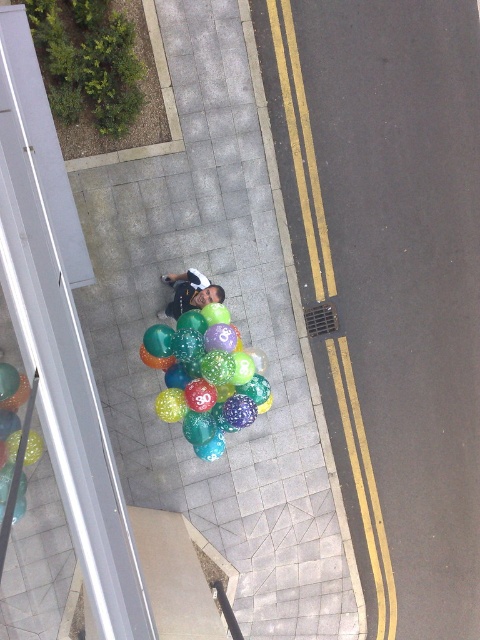
You are a delivery drone flying overhead and need to land on the smooth concrete sidewalk at center. However, there are translucent glossy balloons at center in the way. Based on their positions, can you land safely on the sidewalk?

The smooth concrete sidewalk at center is to the right of the translucent glossy balloons at center, so you can land safely on the sidewalk by moving to the right side of the balloons.

You are standing at the point labeled as point (389, 280) in the image. Based on the scene description, what type of surface are you currently standing on?

You are standing on the smooth concrete sidewalk at center, as the point (389, 280) corresponds to that surface according to the description.

You are a pedestrian standing on the sidewalk and want to walk towards the road. Which object, the smooth concrete pavement at center or the matte black shirt at center, would you encounter first?

The smooth concrete pavement at center is in front of the matte black shirt at center, so you would encounter the smooth concrete pavement at center first.